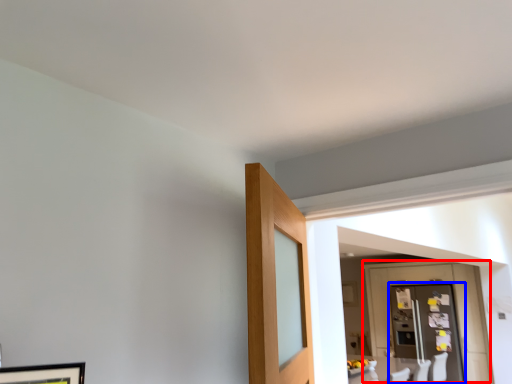
Question: Which of the following is the closest to the observer, door (highlighted by a red box) or glass door (highlighted by a blue box)?

Choices:
 (A) door
 (B) glass door

Answer: (A)